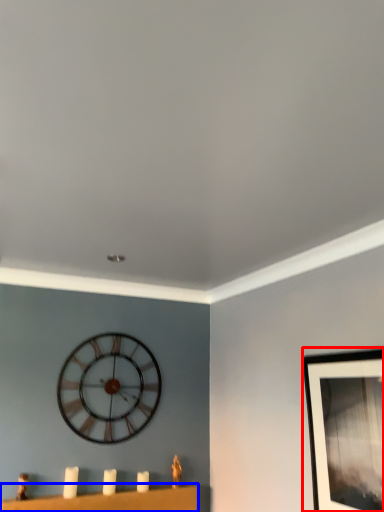
Question: Among these objects, which one is farthest to the camera, picture frame (highlighted by a red box) or furniture (highlighted by a blue box)?

Choices:
 (A) picture frame
 (B) furniture

Answer: (B)